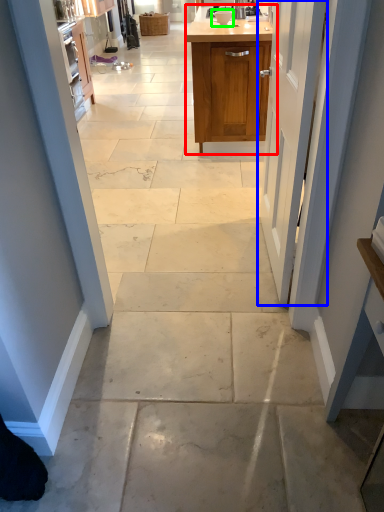
Question: Estimate the real-world distances between objects in this image. Which object is farther from cabinetry (highlighted by a red box), door (highlighted by a blue box) or appliance (highlighted by a green box)?

Choices:
 (A) door
 (B) appliance

Answer: (A)